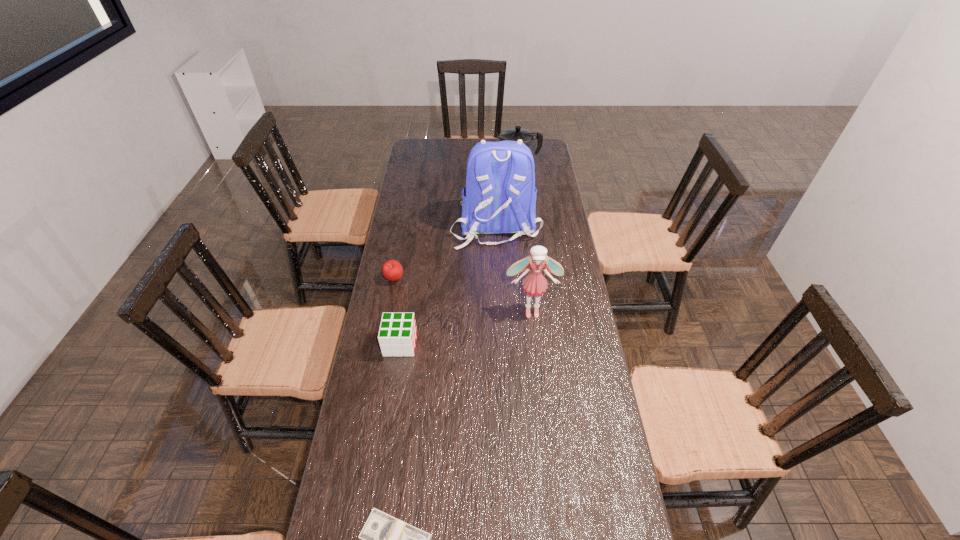
The width and height of the screenshot is (960, 540). Identify the location of vacant space that satisfies the following two spatial constraints: 1. on the front-facing side of the doll; 2. on the red face of the cube. (535, 344).